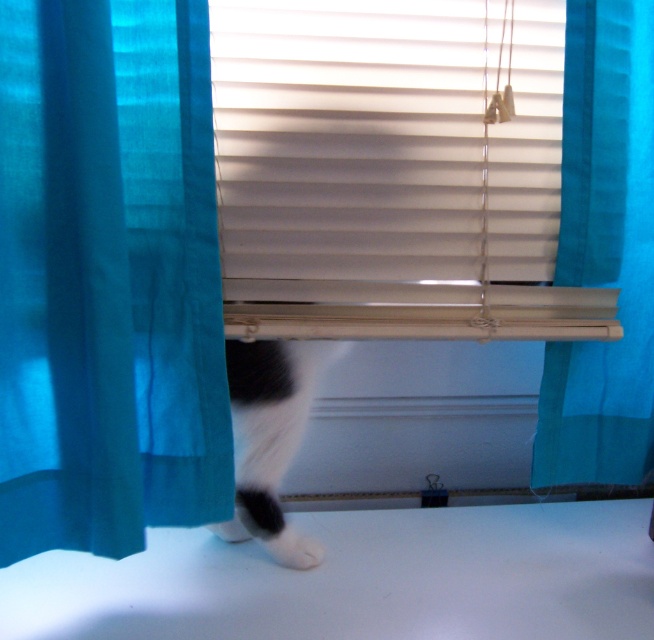
Question: Which point is farther from the camera taking this photo?

Choices:
 (A) (381, 268)
 (B) (177, 125)

Answer: (A)

Question: Estimate the real-world distances between objects in this image. Which object is closer to the teal sheer curtain at left?

Choices:
 (A) teal sheer curtain at right
 (B) black and white fur at lower center

Answer: (B)

Question: In this image, where is teal sheer curtain at left located relative to white plastic blinds at center?

Choices:
 (A) left
 (B) right

Answer: (A)

Question: Which object is closer to the camera taking this photo?

Choices:
 (A) teal sheer curtain at left
 (B) teal sheer curtain at right
 (C) black and white fur at lower center
 (D) white plastic blinds at center

Answer: (A)

Question: From the image, what is the correct spatial relationship of teal sheer curtain at left in relation to white plastic blinds at center?

Choices:
 (A) below
 (B) above

Answer: (A)

Question: Observing the image, what is the correct spatial positioning of white plastic blinds at center in reference to teal sheer curtain at right?

Choices:
 (A) above
 (B) below

Answer: (A)